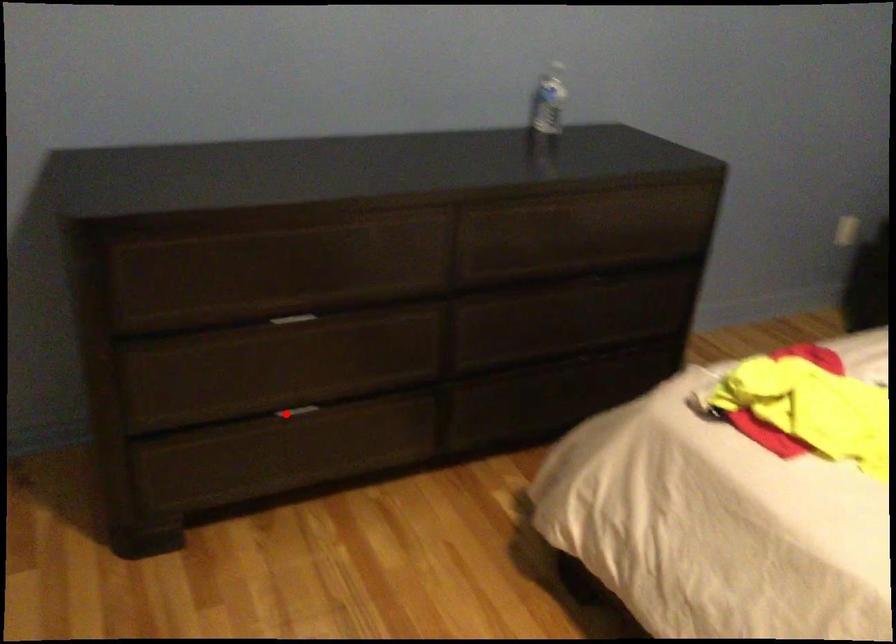
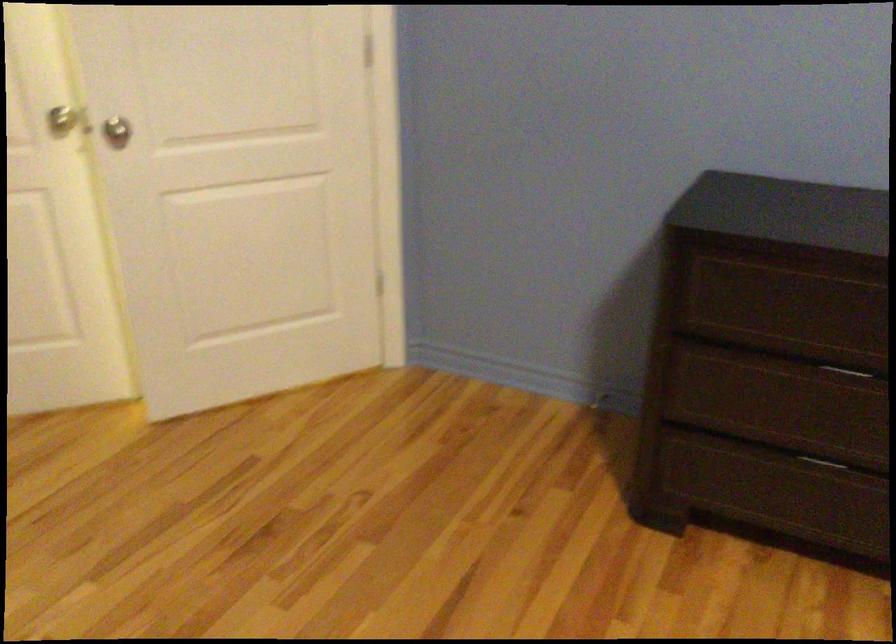
In the second image, find the point that corresponds to the highlighted location in the first image.

(821, 462)